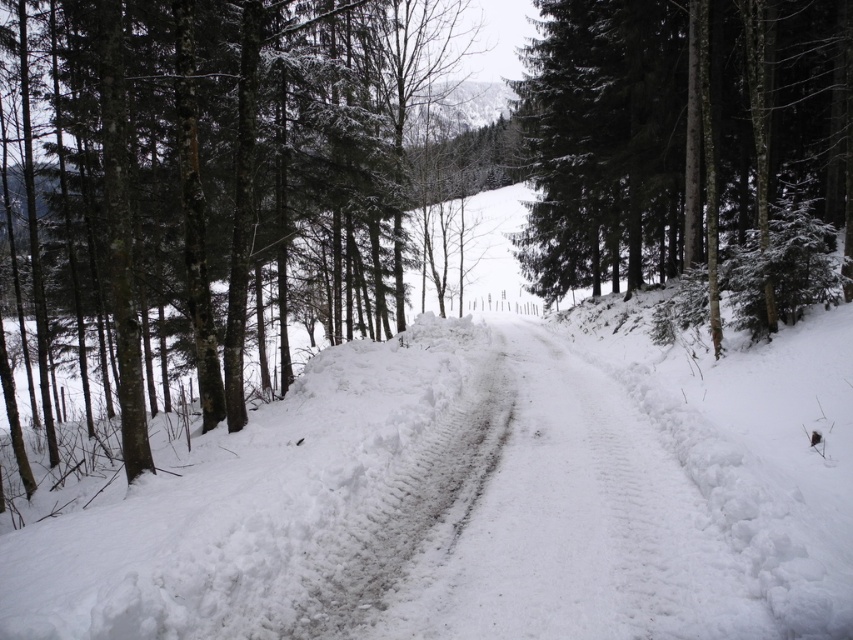
Does white fluffy snow at center appear on the right side of white snow-covered dirt track at center?

Correct, you'll find white fluffy snow at center to the right of white snow-covered dirt track at center.

Can you confirm if white fluffy snow at center is bigger than white snow-covered dirt track at center?

Yes, white fluffy snow at center is bigger than white snow-covered dirt track at center.

Which is in front, point (538, 320) or point (467, 556)?

Point (467, 556)

Locate an element on the screen. Image resolution: width=853 pixels, height=640 pixels. white fluffy snow at center is located at coordinates (479, 496).

Locate an element on the screen. The width and height of the screenshot is (853, 640). white fluffy snow at center is located at coordinates (479, 496).

Between white fluffy snow at center and green textured tree at center, which one has less height?

green textured tree at center is shorter.

Which is behind, point (791, 536) or point (728, 192)?

The point (728, 192) is more distant.

Locate an element on the screen. white fluffy snow at center is located at coordinates (479, 496).

Does white fluffy snow at center have a greater height compared to dark green textured tree at left?

In fact, white fluffy snow at center may be shorter than dark green textured tree at left.

You are a GUI agent. You are given a task and a screenshot of the screen. Output one action in this format:
    pyautogui.click(x=<x>, y=<y>)
    Task: Click on the white fluffy snow at center
    This screenshot has width=853, height=640.
    Given the screenshot: What is the action you would take?
    pyautogui.click(x=479, y=496)

Is point (361, 502) more distant than point (321, 68)?

No, (361, 502) is closer to viewer.

Where is `white fluffy snow at center`? The width and height of the screenshot is (853, 640). white fluffy snow at center is located at coordinates (479, 496).